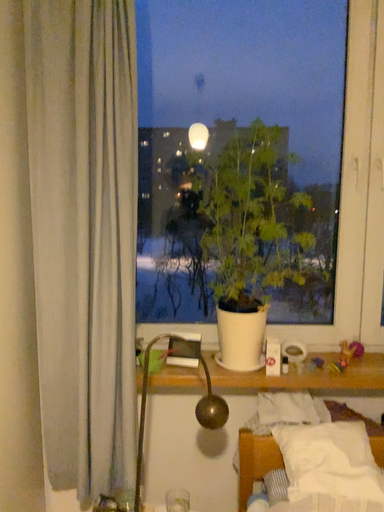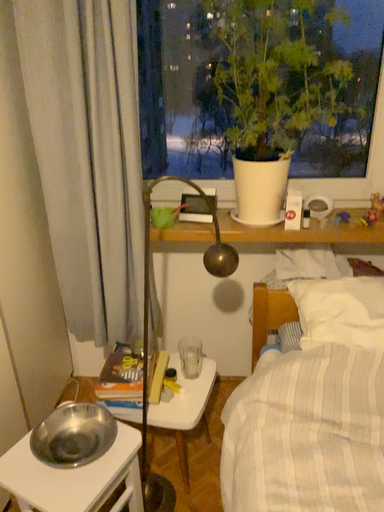
Question: How did the camera likely rotate when shooting the video?

Choices:
 (A) rotated downward
 (B) rotated upward

Answer: (A)